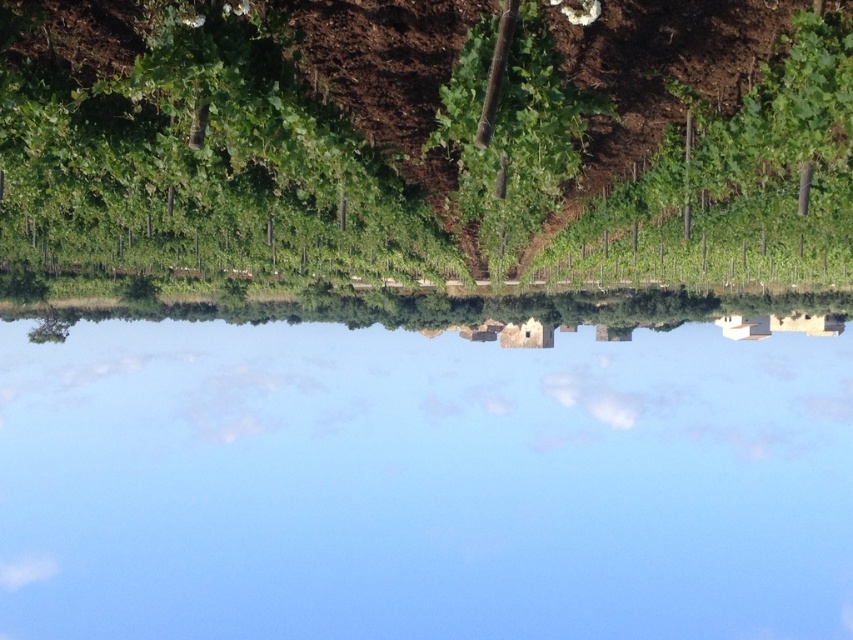
Is blue sky at upper center shorter than green leafy plant at center?

Incorrect, blue sky at upper center's height does not fall short of green leafy plant at center's.

Is blue sky at upper center to the right of green leafy plant at center from the viewer's perspective?

Correct, you'll find blue sky at upper center to the right of green leafy plant at center.

Locate an element on the screen. blue sky at upper center is located at coordinates (428, 470).